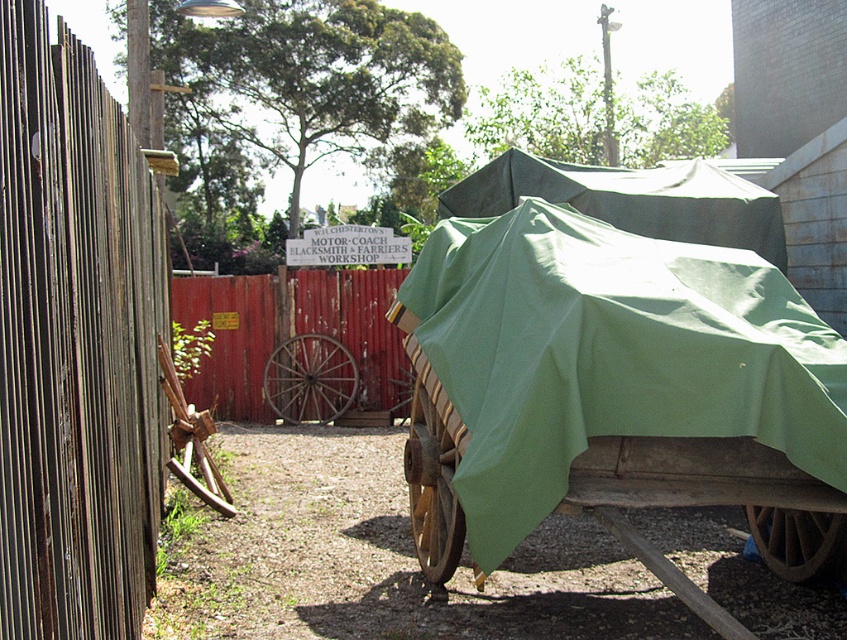
Question: Considering the relative positions of green fabric-covered wagon at center and green fabric cart at center in the image provided, where is green fabric-covered wagon at center located with respect to green fabric cart at center?

Choices:
 (A) above
 (B) below

Answer: (B)

Question: Among these objects, which one is nearest to the camera?

Choices:
 (A) wooden planks at left
 (B) red wood fence at center
 (C) green fabric-covered wagon at center

Answer: (A)

Question: Does wooden planks at left have a smaller size compared to red wood fence at center?

Choices:
 (A) yes
 (B) no

Answer: (B)

Question: Which object appears farthest from the camera in this image?

Choices:
 (A) red wood fence at center
 (B) green fabric cart at center

Answer: (A)

Question: Is wooden planks at left wider than green fabric-covered wagon at center?

Choices:
 (A) yes
 (B) no

Answer: (A)

Question: Which object is closer to the camera taking this photo?

Choices:
 (A) wooden planks at left
 (B) green fabric cart at center

Answer: (A)